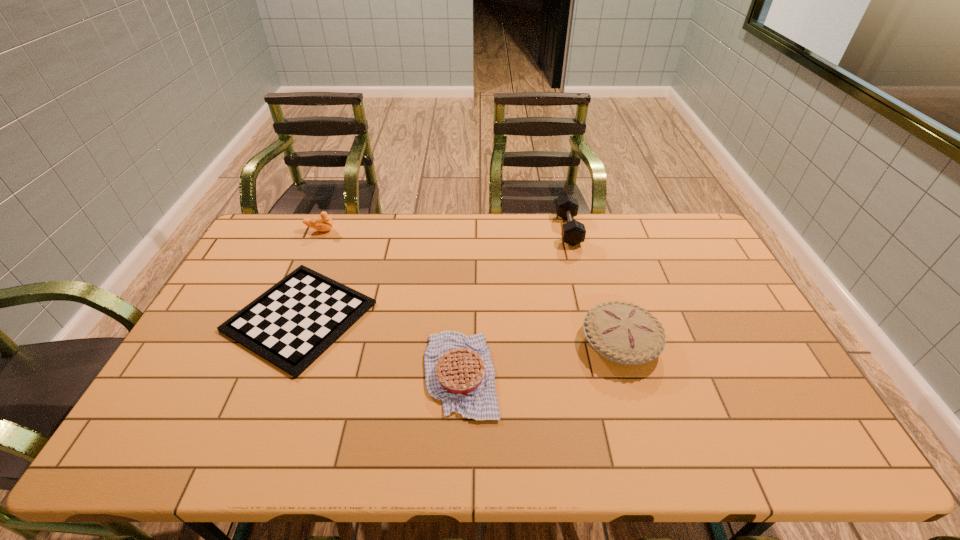
This screenshot has width=960, height=540. Find the location of `dumbbell`. dumbbell is located at coordinates (573, 232).

Locate an element on the screen. duckling is located at coordinates (324, 223).

Image resolution: width=960 pixels, height=540 pixels. Find the location of `the taller pie`. the taller pie is located at coordinates (626, 334).

Image resolution: width=960 pixels, height=540 pixels. In order to click on the shorter pie in this screenshot , I will do `click(459, 371)`.

The width and height of the screenshot is (960, 540). I want to click on the third object from right to left, so click(x=459, y=371).

Find the location of a particular element. This screenshot has width=960, height=540. the shortest object is located at coordinates (290, 325).

Identify the location of vacant space situated on the front of the dumbbell. Image resolution: width=960 pixels, height=540 pixels. (589, 317).

Find the location of a particular element. vacant region located 0.270m on the face of the duckling is located at coordinates (408, 230).

At what (x,y) coordinates should I click in order to perform the action: click on free space located 0.200m on the right of the right pie. Please return your answer as a coordinate pair (x, y). This screenshot has width=960, height=540. Looking at the image, I should click on (730, 342).

Where is `vacant space located 0.340m on the right of the left pie`? The image size is (960, 540). vacant space located 0.340m on the right of the left pie is located at coordinates (626, 374).